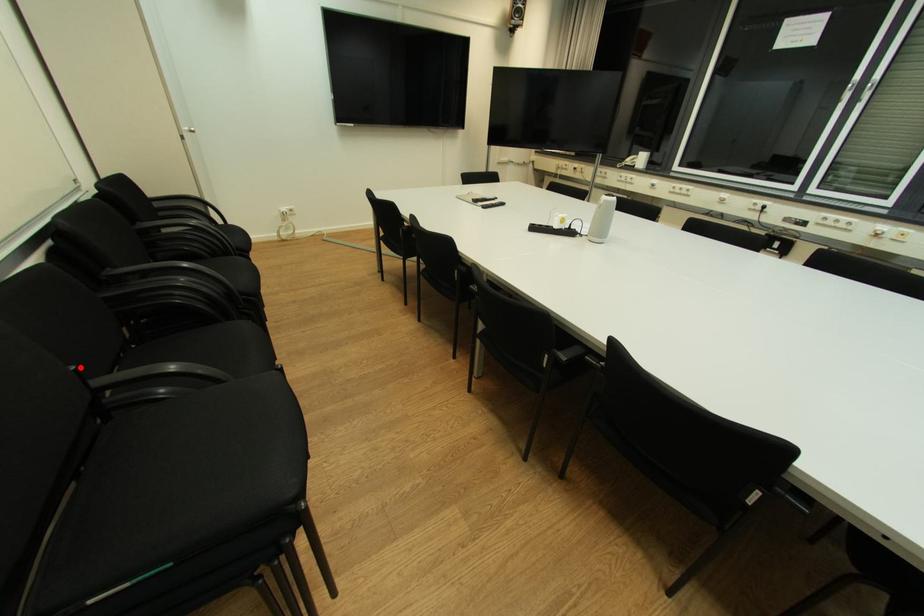
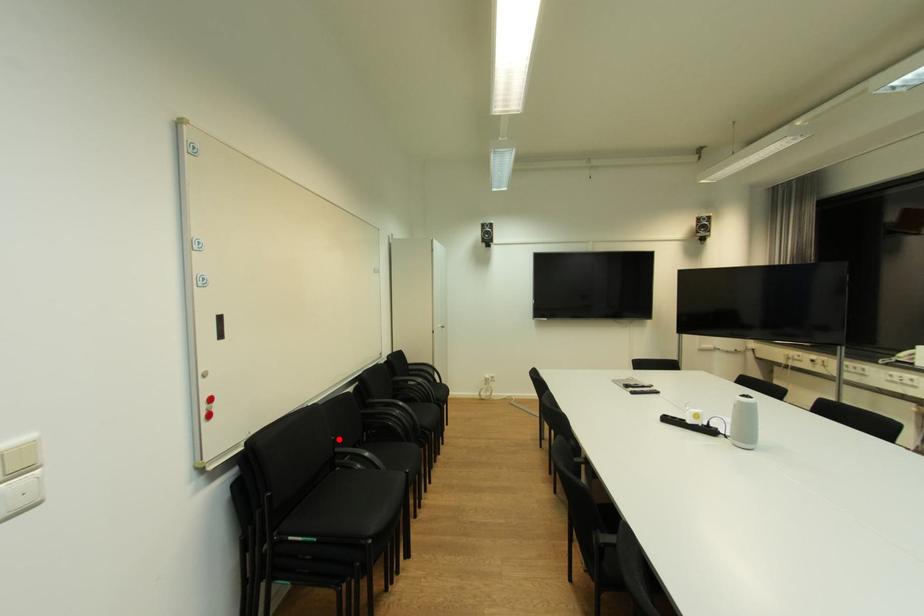
I am providing you with two images of the same scene from different viewpoints. A red point is marked on the first image and another point is marked on the second image. Does the point marked in image1 correspond to the same location as the one in image2?

Yes